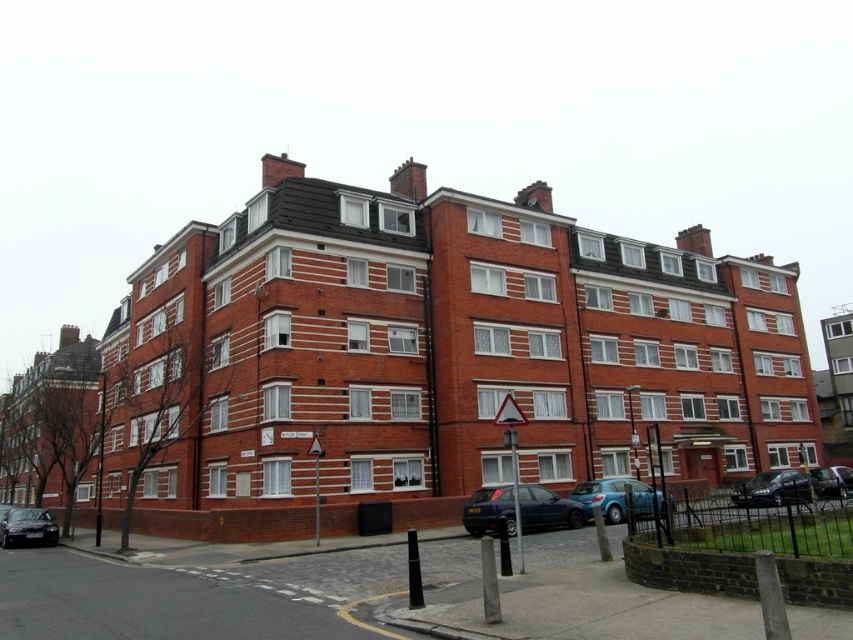
You are a pedestrian standing at the crosswalk on the street corner. You see the matte black car at center and the shiny black car at lower right. Which car is closer to your left side?

The matte black car at center is to the left of the shiny black car at lower right, so it is closer to your left side.

You are a delivery person needing to cross the street to deliver a package to the residential building. The street has a speed limit of 40 km per hour. Can you safely cross the street before the cars at shiny black car at lower right and shiny black sedan at lower left reach you?

The distance between the shiny black car at lower right and the shiny black sedan at lower left is 35.43 meters. Since the cars are 35.43 meters away from each other, and the speed limit is 40 km per hour, you have enough time to cross the street safely before the cars reach you.